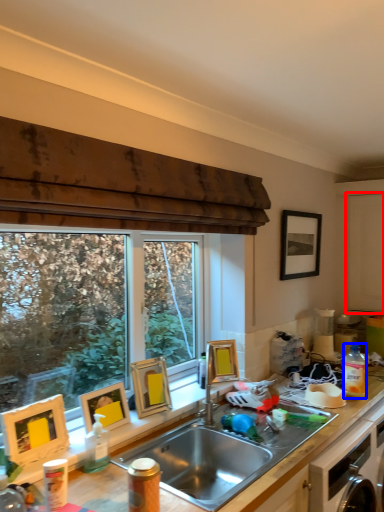
Question: Among these objects, which one is nearest to the camera, screen door (highlighted by a red box) or bottle (highlighted by a blue box)?

Choices:
 (A) screen door
 (B) bottle

Answer: (B)